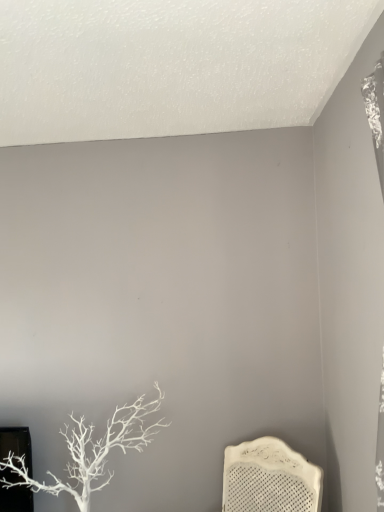
What do you see at coordinates (91, 451) in the screenshot? I see `white matte tree at lower left` at bounding box center [91, 451].

What are the coordinates of `white matte tree at lower left` in the screenshot? It's located at (91, 451).

I want to click on white matte tree at lower left, so click(x=91, y=451).